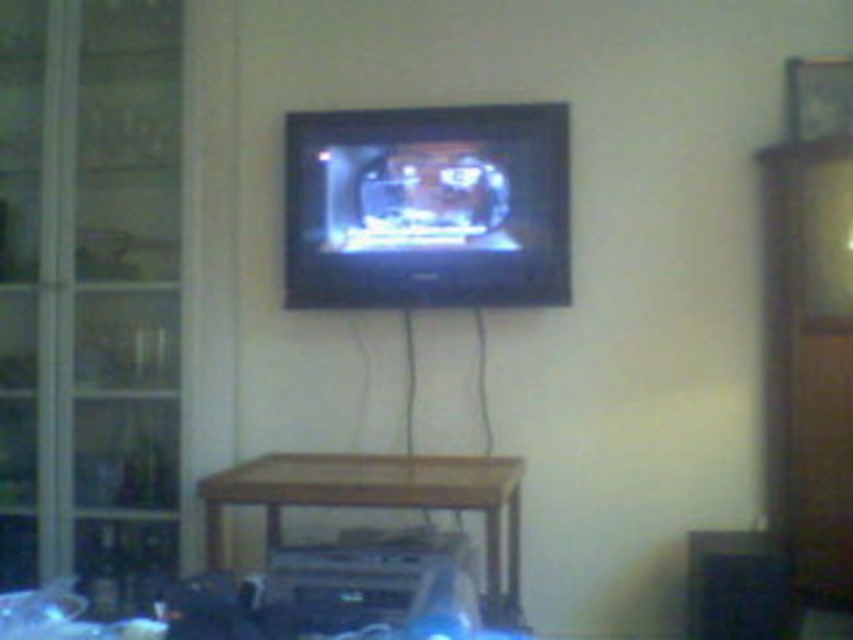
Question: Is matte black flat screen tv at center to the right of wooden table at lower center from the viewer's perspective?

Choices:
 (A) no
 (B) yes

Answer: (B)

Question: Which of the following is the closest to the observer?

Choices:
 (A) matte black flat screen tv at center
 (B) wooden table at lower center

Answer: (B)

Question: Which point is farther to the camera?

Choices:
 (A) matte black flat screen tv at center
 (B) wooden table at lower center

Answer: (A)

Question: Can you confirm if matte black flat screen tv at center is smaller than wooden table at lower center?

Choices:
 (A) no
 (B) yes

Answer: (B)

Question: Does matte black flat screen tv at center have a smaller size compared to wooden table at lower center?

Choices:
 (A) no
 (B) yes

Answer: (B)

Question: Which of the following is the closest to the observer?

Choices:
 (A) (312, 492)
 (B) (560, 305)

Answer: (A)